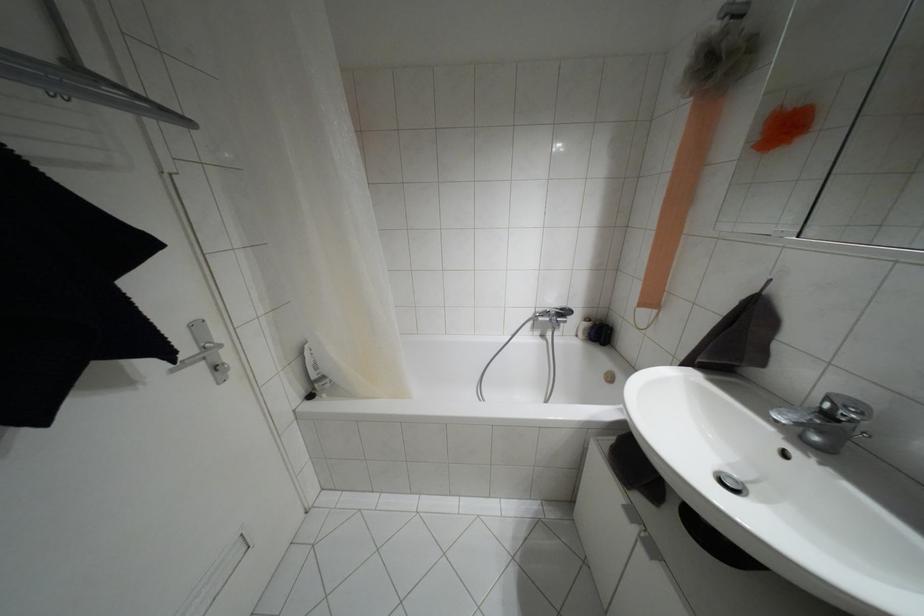
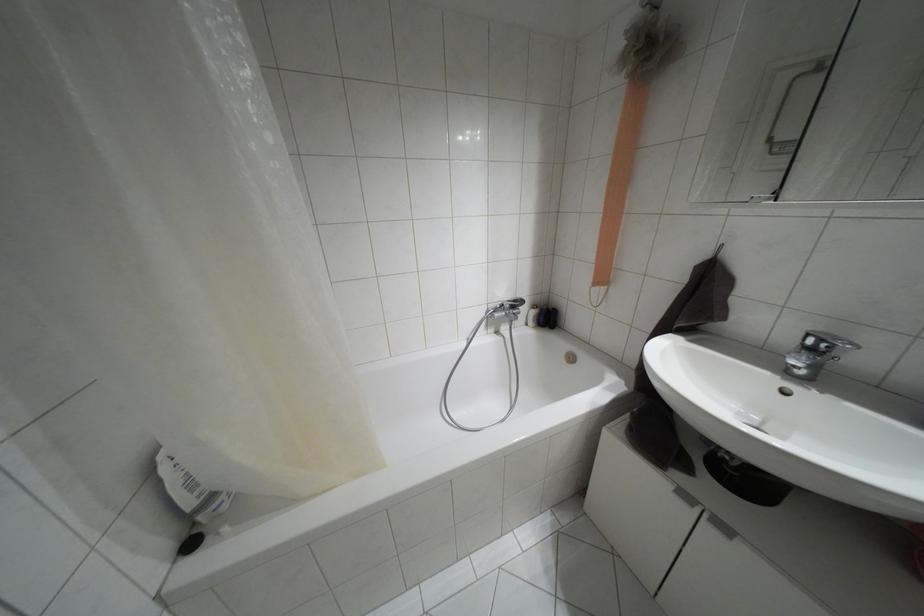
In the second image, find the point that corresponds to point (322, 377) in the first image.

(212, 496)